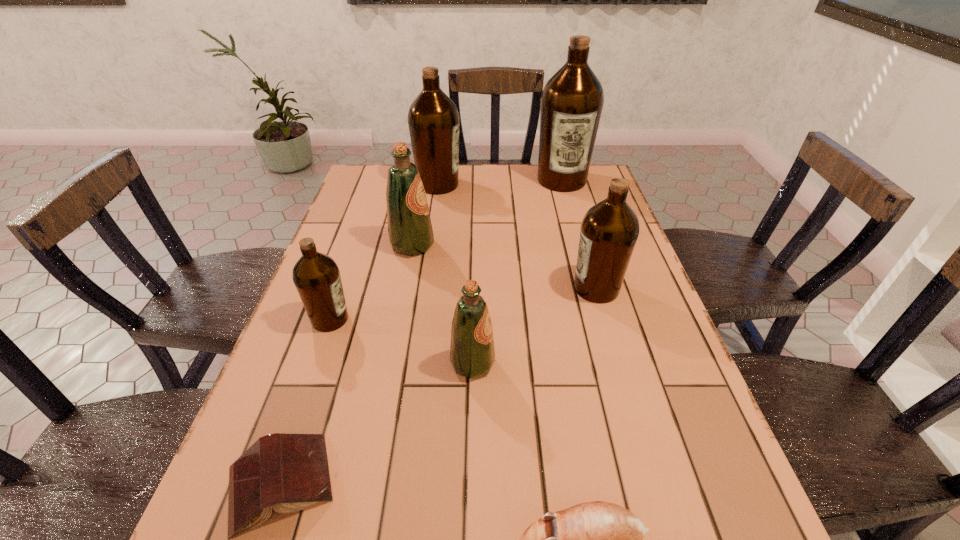
This screenshot has width=960, height=540. Find the location of `the leftmost olive oil`. the leftmost olive oil is located at coordinates tap(316, 276).

Where is `vacant space located 0.160m on the label of the tallest object`? The height and width of the screenshot is (540, 960). vacant space located 0.160m on the label of the tallest object is located at coordinates (573, 222).

At what (x,y) coordinates should I click in order to perform the action: click on free space located 0.100m on the label of the third smallest brown olive oil. Please return your answer as a coordinate pair (x, y). This screenshot has height=540, width=960. Looking at the image, I should click on (491, 185).

Where is `vacant space located 0.210m on the front-facing side of the sixth nearest object`? Image resolution: width=960 pixels, height=540 pixels. vacant space located 0.210m on the front-facing side of the sixth nearest object is located at coordinates (509, 245).

Find the location of `free location located on the label of the third biggest brown olive oil`. free location located on the label of the third biggest brown olive oil is located at coordinates [484, 288].

At what (x,y) coordinates should I click in order to perform the action: click on free space located on the label of the third biggest brown olive oil. Please return your answer as a coordinate pair (x, y). Looking at the image, I should click on (488, 288).

This screenshot has width=960, height=540. What are the coordinates of `vacant space located 0.330m on the label of the third biggest brown olive oil` in the screenshot? It's located at (440, 288).

The height and width of the screenshot is (540, 960). I want to click on vacant region located 0.100m on the front-facing side of the third olive oil from right to left, so click(542, 363).

Identify the location of free spot located 0.090m on the label of the leftmost olive oil. (389, 319).

Where is `object present at the left edge`? The height and width of the screenshot is (540, 960). object present at the left edge is located at coordinates (316, 276).